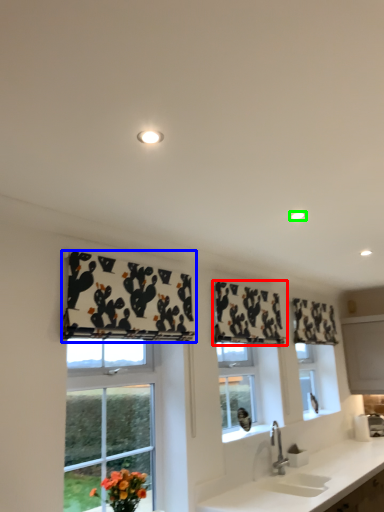
Question: Which is nearer to the curtain (highlighted by a red box)? curtain (highlighted by a blue box) or lighting (highlighted by a green box).

Choices:
 (A) curtain
 (B) lighting

Answer: (A)